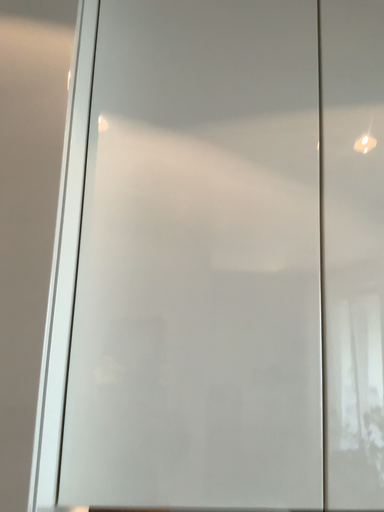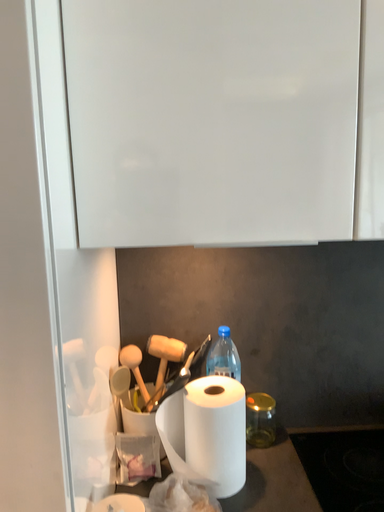
Question: Which way did the camera rotate in the video?

Choices:
 (A) rotated upward
 (B) rotated downward

Answer: (B)